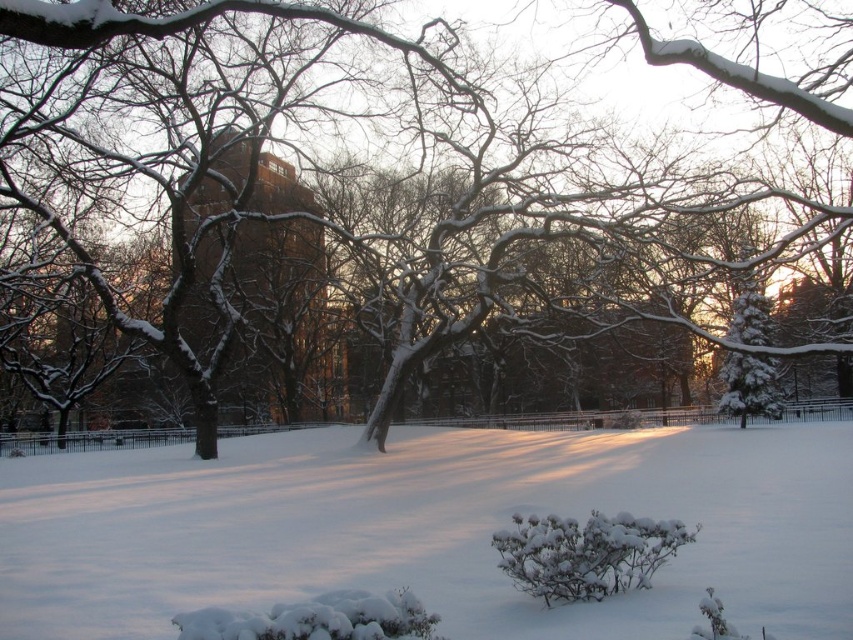
How distant is white fluffy snow at center from snow-covered branches at center?

white fluffy snow at center and snow-covered branches at center are 6.84 meters apart.

Is white fluffy snow at center bigger than snow-covered branches at center?

Actually, white fluffy snow at center might be smaller than snow-covered branches at center.

I want to click on white fluffy snow at center, so click(427, 529).